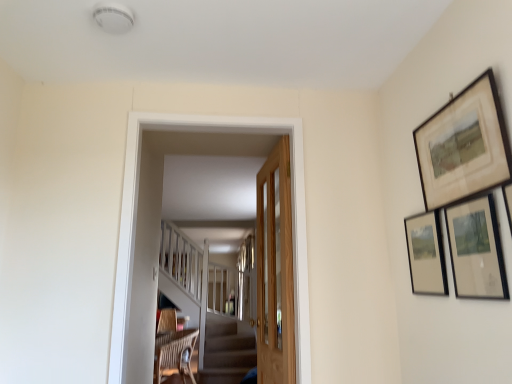
Question: Is there a large distance between wooden-framed picture at upper right, which ranks as the first picture frame in bottom-to-top order, and wooden door at center?

Choices:
 (A) no
 (B) yes

Answer: (A)

Question: Does wooden-framed picture at upper right, which ranks as the first picture frame in bottom-to-top order, contain wooden door at center?

Choices:
 (A) no
 (B) yes

Answer: (A)

Question: Is wooden-framed picture at upper right, which ranks as the first picture frame in bottom-to-top order, thinner than wooden door at center?

Choices:
 (A) yes
 (B) no

Answer: (A)

Question: Is wooden-framed picture at upper right, arranged as the 3th picture frame when viewed from the top, at the left side of wooden door at center?

Choices:
 (A) yes
 (B) no

Answer: (B)

Question: Does wooden-framed picture at upper right, arranged as the 3th picture frame when viewed from the top, turn towards wooden door at center?

Choices:
 (A) no
 (B) yes

Answer: (A)

Question: From a real-world perspective, relative to wooden-framed artwork at upper right, the first picture frame when ordered from top to bottom, is wooden door at center vertically above or below?

Choices:
 (A) below
 (B) above

Answer: (A)

Question: From the image's perspective, is wooden door at center above or below wooden-framed artwork at upper right, the first picture frame when ordered from top to bottom?

Choices:
 (A) below
 (B) above

Answer: (A)

Question: Would you say wooden door at center is to the left or to the right of wooden-framed artwork at upper right, which is counted as the third picture frame, starting from the bottom, in the picture?

Choices:
 (A) left
 (B) right

Answer: (A)

Question: Looking at their shapes, would you say wooden door at center is wider or thinner than wooden-framed artwork at upper right, the first picture frame when ordered from top to bottom?

Choices:
 (A) wide
 (B) thin

Answer: (A)

Question: Is wooden door at center in front of or behind wooden door at center in the image?

Choices:
 (A) behind
 (B) front

Answer: (B)

Question: Would you say wooden door at center is to the left or to the right of wooden door at center in the picture?

Choices:
 (A) left
 (B) right

Answer: (A)

Question: From a real-world perspective, is wooden door at center positioned above or below wooden door at center?

Choices:
 (A) below
 (B) above

Answer: (B)

Question: From the image's perspective, is wooden door at center located above or below wooden door at center?

Choices:
 (A) below
 (B) above

Answer: (B)

Question: From the image's perspective, relative to matte black picture frame at right, arranged as the 2th picture frame when viewed from the top, is wooden door at center above or below?

Choices:
 (A) below
 (B) above

Answer: (A)

Question: Is point (279, 157) positioned closer to the camera than point (497, 276)?

Choices:
 (A) closer
 (B) farther

Answer: (B)